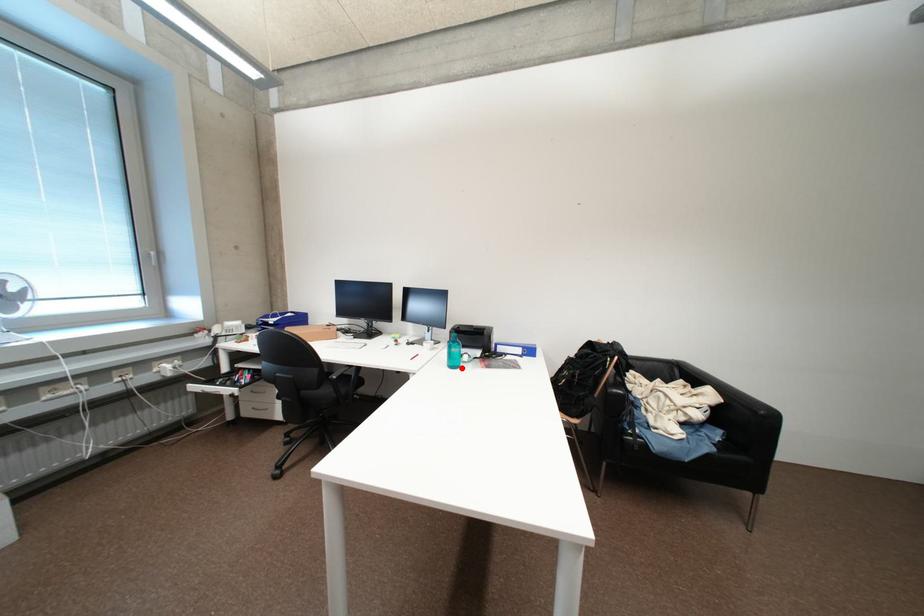
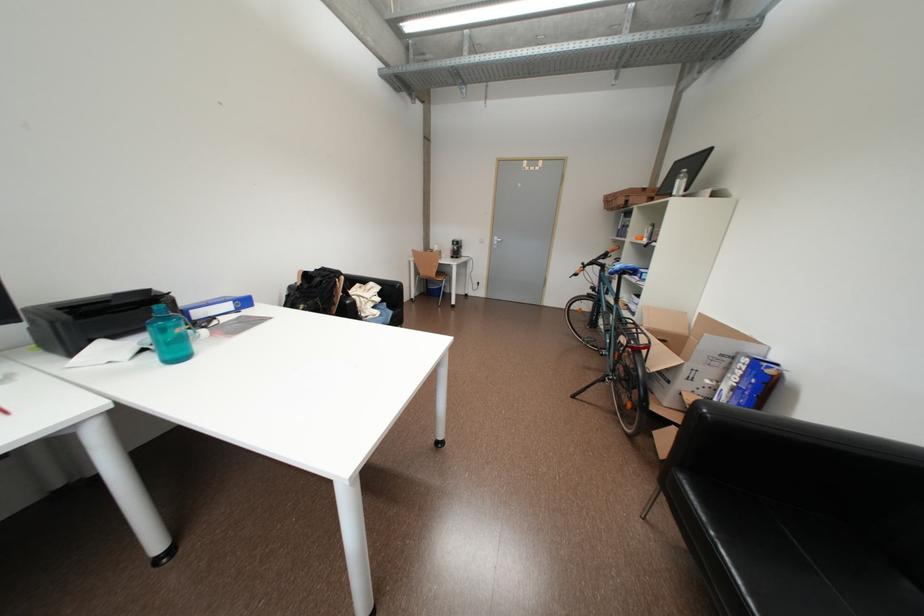
Where in the second image is the point corresponding to the highlighted location from the first image?

(186, 360)